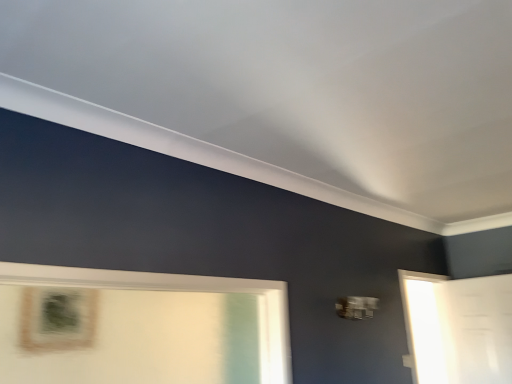
Image resolution: width=512 pixels, height=384 pixels. In order to click on white glossy mirror at lower left in this screenshot , I will do `click(140, 327)`.

Describe the element at coordinates (140, 327) in the screenshot. Image resolution: width=512 pixels, height=384 pixels. I see `white glossy mirror at lower left` at that location.

Locate an element on the screen. The image size is (512, 384). white glossy mirror at lower left is located at coordinates (140, 327).